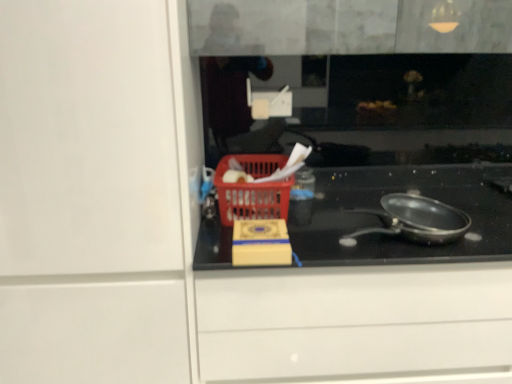
Question: Is black glass cooktop at center located within shiny black frying pan at center?

Choices:
 (A) no
 (B) yes

Answer: (A)

Question: Does shiny black frying pan at center have a greater height compared to black glass cooktop at center?

Choices:
 (A) no
 (B) yes

Answer: (A)

Question: Can you confirm if shiny black frying pan at center is bigger than black glass cooktop at center?

Choices:
 (A) no
 (B) yes

Answer: (A)

Question: Is shiny black frying pan at center not close to black glass cooktop at center?

Choices:
 (A) yes
 (B) no

Answer: (B)

Question: From the image's perspective, is shiny black frying pan at center on black glass cooktop at center?

Choices:
 (A) yes
 (B) no

Answer: (A)

Question: In the image, is black glass cooktop at center positioned in front of or behind shiny black frying pan at center?

Choices:
 (A) behind
 (B) front

Answer: (A)

Question: Looking at their shapes, would you say black glass cooktop at center is wider or thinner than shiny black frying pan at center?

Choices:
 (A) thin
 (B) wide

Answer: (B)

Question: From a real-world perspective, is black glass cooktop at center above or below shiny black frying pan at center?

Choices:
 (A) below
 (B) above

Answer: (A)

Question: Choose the correct answer: Is black glass cooktop at center inside shiny black frying pan at center or outside it?

Choices:
 (A) outside
 (B) inside

Answer: (A)

Question: Choose the correct answer: Is red plastic basket at center inside black glass cooktop at center or outside it?

Choices:
 (A) inside
 (B) outside

Answer: (B)

Question: From the image's perspective, relative to black glass cooktop at center, is red plastic basket at center above or below?

Choices:
 (A) below
 (B) above

Answer: (B)

Question: In the image, is red plastic basket at center positioned in front of or behind black glass cooktop at center?

Choices:
 (A) front
 (B) behind

Answer: (B)

Question: In terms of size, does red plastic basket at center appear bigger or smaller than black glass cooktop at center?

Choices:
 (A) small
 (B) big

Answer: (A)

Question: Is point 220,173 closer or farther from the camera than point 437,243?

Choices:
 (A) farther
 (B) closer

Answer: (A)

Question: Is red plastic basket at center situated inside shiny black frying pan at center or outside?

Choices:
 (A) inside
 (B) outside

Answer: (B)